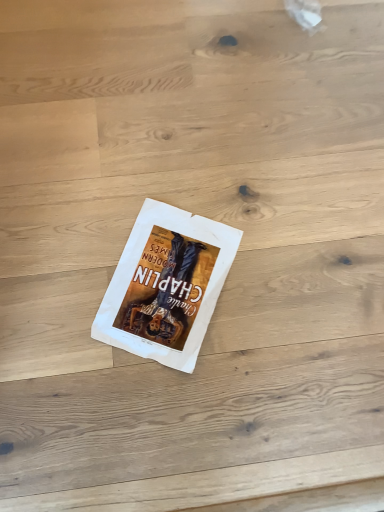
Where is `free point to the left of white paper book at center`? The image size is (384, 512). free point to the left of white paper book at center is located at coordinates (56, 261).